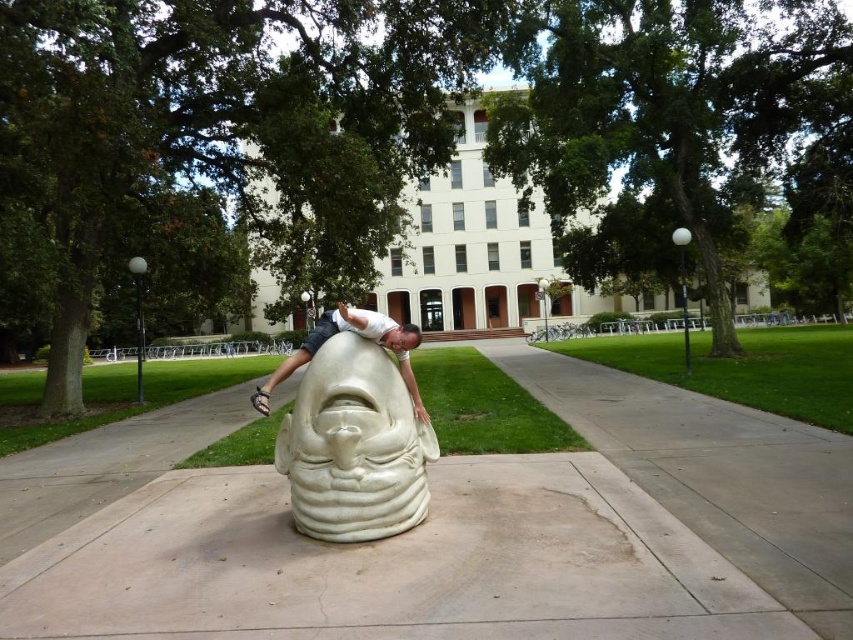
You are standing in front of the sculpture and looking at the two points marked on the image. Which point, point (494, 611) or point (325, 474), is closer to you?

Point (494, 611) is closer to the camera than point (325, 474), so it is closer to you.

You are standing at point (x=389, y=564) in the image. What object are you standing on?

You are standing on the white concrete sculpture at center located at point (x=389, y=564).